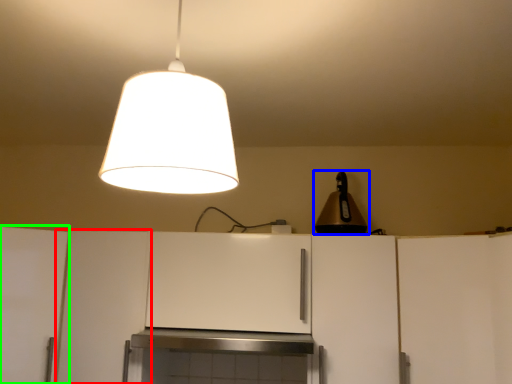
Question: Which is nearer to the cabinetry (highlighted by a red box)? lamp (highlighted by a blue box) or cabinetry (highlighted by a green box).

Choices:
 (A) lamp
 (B) cabinetry

Answer: (B)